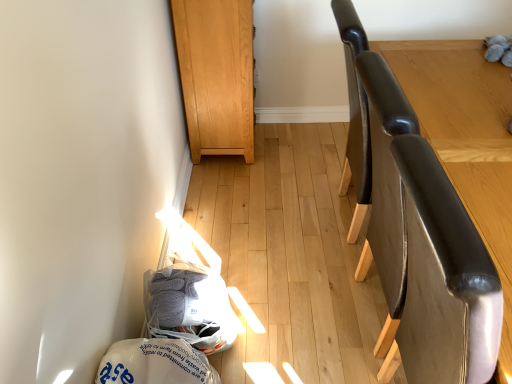
Where is `vacant space to the right of gray yarn at lower left, which is the 1th material from top to bottom`? vacant space to the right of gray yarn at lower left, which is the 1th material from top to bottom is located at coordinates (270, 337).